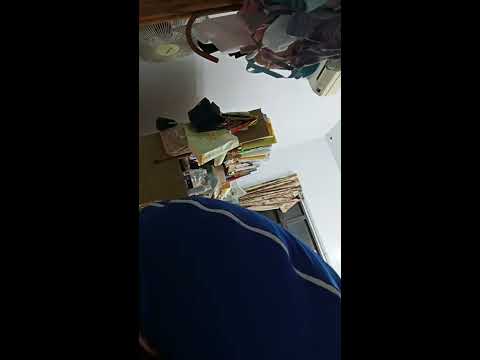
Find the location of `pillow`. pillow is located at coordinates (232, 267).